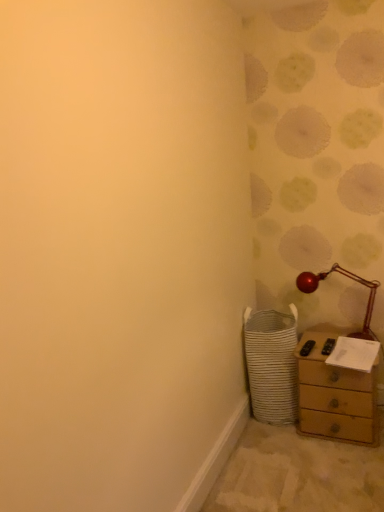
Question: Is metallic red table lamp at right touching wooden chest of drawers at lower right?

Choices:
 (A) yes
 (B) no

Answer: (B)

Question: Is metallic red table lamp at right looking in the opposite direction of wooden chest of drawers at lower right?

Choices:
 (A) yes
 (B) no

Answer: (B)

Question: Does metallic red table lamp at right come in front of wooden chest of drawers at lower right?

Choices:
 (A) no
 (B) yes

Answer: (A)

Question: Is metallic red table lamp at right aimed at wooden chest of drawers at lower right?

Choices:
 (A) no
 (B) yes

Answer: (A)

Question: Is metallic red table lamp at right behind wooden chest of drawers at lower right?

Choices:
 (A) yes
 (B) no

Answer: (A)

Question: Considering the relative positions of metallic red table lamp at right and wooden chest of drawers at lower right in the image provided, is metallic red table lamp at right to the left of wooden chest of drawers at lower right from the viewer's perspective?

Choices:
 (A) no
 (B) yes

Answer: (B)

Question: From a real-world perspective, is metallic red table lamp at right on white woven laundry basket at lower right?

Choices:
 (A) no
 (B) yes

Answer: (B)

Question: Does metallic red table lamp at right have a lesser width compared to white woven laundry basket at lower right?

Choices:
 (A) yes
 (B) no

Answer: (A)

Question: Does metallic red table lamp at right appear on the left side of white woven laundry basket at lower right?

Choices:
 (A) yes
 (B) no

Answer: (B)

Question: Does metallic red table lamp at right come in front of white woven laundry basket at lower right?

Choices:
 (A) no
 (B) yes

Answer: (A)

Question: Is metallic red table lamp at right aimed at white woven laundry basket at lower right?

Choices:
 (A) no
 (B) yes

Answer: (A)

Question: Is metallic red table lamp at right positioned behind white woven laundry basket at lower right?

Choices:
 (A) yes
 (B) no

Answer: (A)

Question: Does white woven laundry basket at lower right touch wooden chest of drawers at lower right?

Choices:
 (A) yes
 (B) no

Answer: (B)